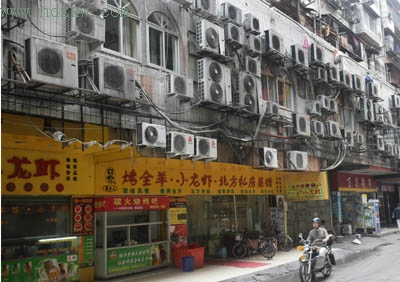
Locate an element on the screen. The width and height of the screenshot is (400, 282). red bin is located at coordinates (201, 253).